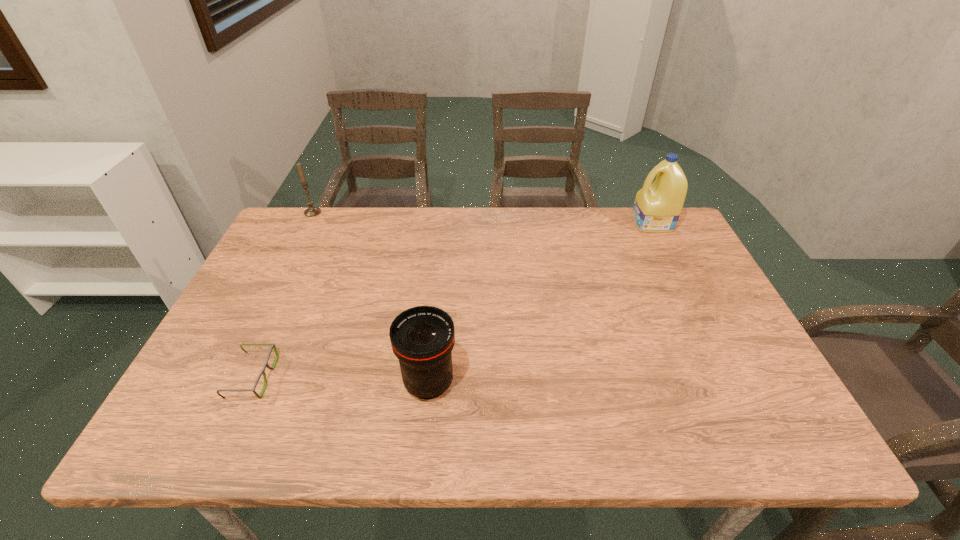
This screenshot has width=960, height=540. What are the coordinates of `free space that satisfies the following two spatial constraints: 1. on the lens of the telephoto lens; 2. on the right side of the spectacles` in the screenshot? It's located at (251, 383).

The height and width of the screenshot is (540, 960). I want to click on vacant point that satisfies the following two spatial constraints: 1. on the lens of the spectacles; 2. on the right side of the telephoto lens, so click(x=251, y=383).

What are the coordinates of `vacant region that satisfies the following two spatial constraints: 1. on the lens of the third object from left to right; 2. on the left side of the spectacles` in the screenshot? It's located at (251, 383).

Find the location of a particular element. This screenshot has height=540, width=960. free space that satisfies the following two spatial constraints: 1. on the label of the rightmost object; 2. on the front side of the telephoto lens is located at coordinates (732, 383).

Where is `vacant space that satisfies the following two spatial constraints: 1. on the lens of the telephoto lens; 2. on the right side of the spectacles`? Image resolution: width=960 pixels, height=540 pixels. vacant space that satisfies the following two spatial constraints: 1. on the lens of the telephoto lens; 2. on the right side of the spectacles is located at coordinates (251, 383).